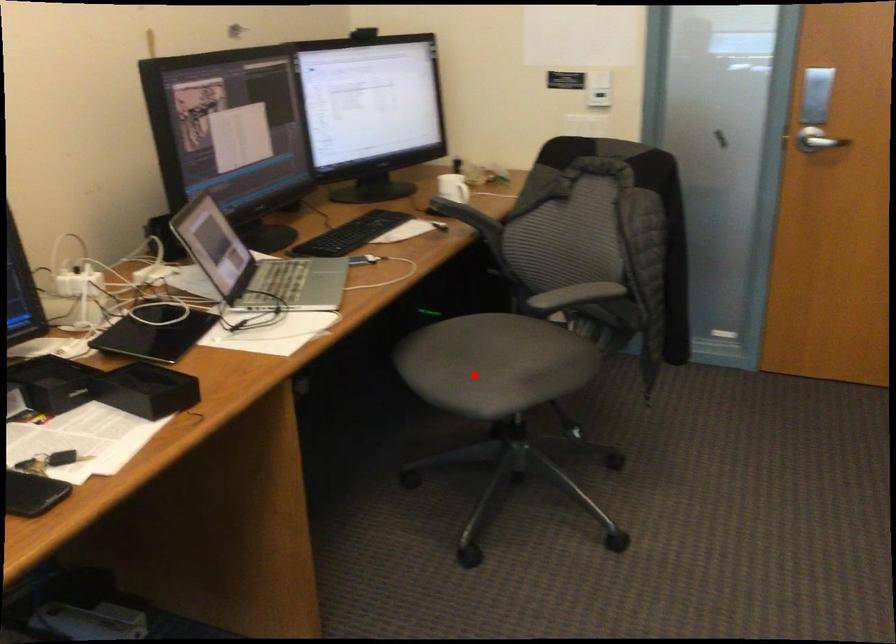
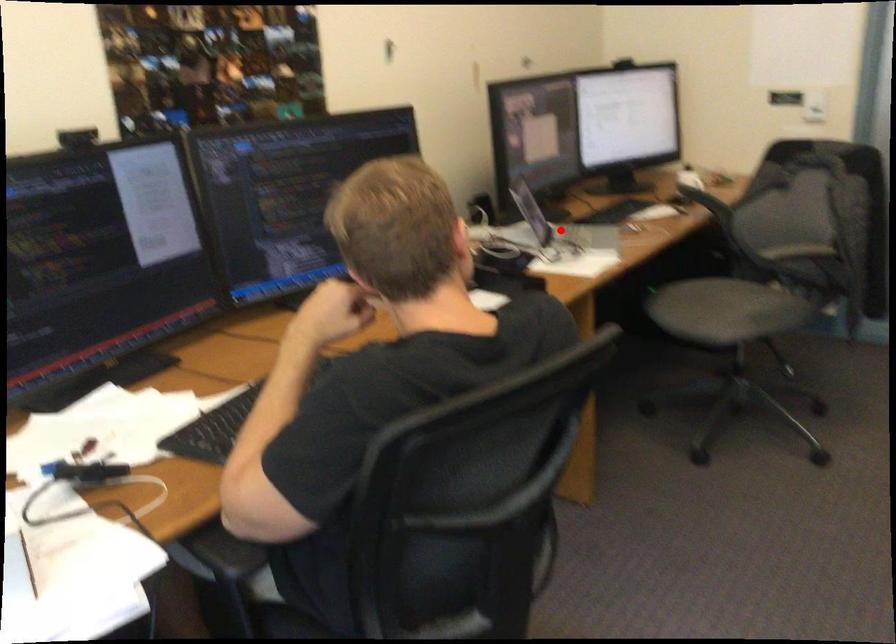
I am providing you with two images of the same scene from different viewpoints. A red point is marked on the first image and another point is marked on the second image. Do the highlighted points in image1 and image2 indicate the same real-world spot?

No